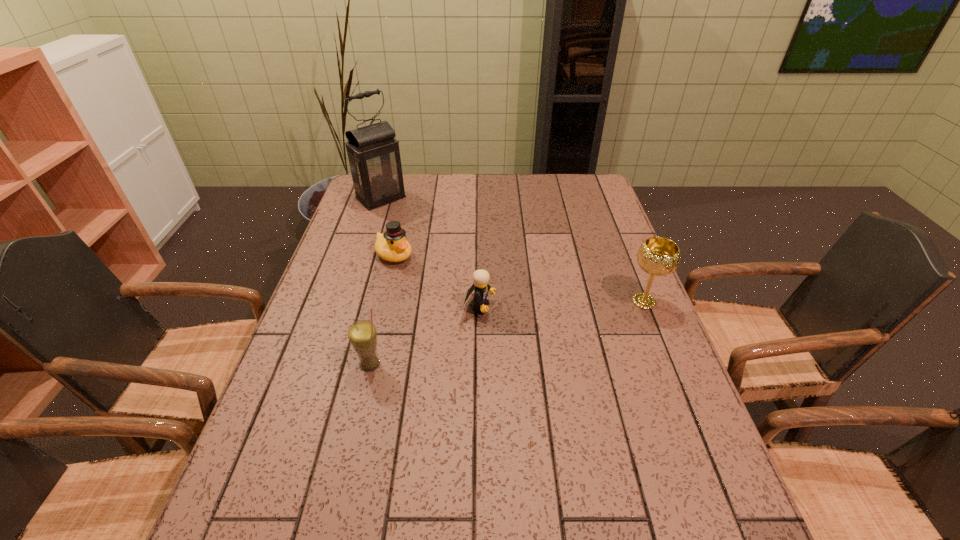
Identify the location of the nearest object. The height and width of the screenshot is (540, 960). (362, 334).

The height and width of the screenshot is (540, 960). I want to click on the rightmost object, so point(658,256).

Identify the location of the second farthest object. click(x=392, y=246).

Find the location of a particular element. This screenshot has width=960, height=540. the second object from right to left is located at coordinates (480, 277).

I want to click on the farthest object, so click(374, 157).

The height and width of the screenshot is (540, 960). In order to click on the tallest object in this screenshot , I will do `click(374, 157)`.

Locate an element on the screen. The height and width of the screenshot is (540, 960). free space located on the left of the nearest object is located at coordinates (x=305, y=364).

The image size is (960, 540). In order to click on free space located 0.250m on the back of the rightmost object in this screenshot , I will do `click(618, 237)`.

Identify the location of vacant space located 0.150m on the front-facing side of the duck. click(439, 288).

Identify the location of vacant space situated 0.150m on the front-facing side of the duck. The height and width of the screenshot is (540, 960). (439, 288).